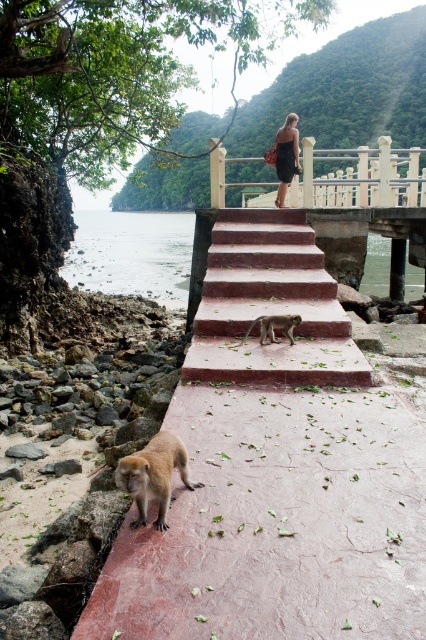
In the scene shown: Does smooth concrete stairs at center have a larger size compared to black dress at upper center?

Yes, smooth concrete stairs at center is bigger than black dress at upper center.

Does smooth concrete stairs at center come behind black dress at upper center?

No.

Identify the location of smooth concrete stairs at center. The image size is (426, 640). (270, 305).

Locate an element on the screen. The width and height of the screenshot is (426, 640). smooth concrete stairs at center is located at coordinates (270, 305).

Does smooth concrete stairs at center have a lesser width compared to brown furry monkey at center?

In fact, smooth concrete stairs at center might be wider than brown furry monkey at center.

Is smooth concrete stairs at center positioned before brown furry monkey at center?

No, smooth concrete stairs at center is behind brown furry monkey at center.

From the picture: Who is more forward, (293, 296) or (290, 317)?

Point (290, 317)

The height and width of the screenshot is (640, 426). Find the location of `smooth concrete stairs at center`. smooth concrete stairs at center is located at coordinates (270, 305).

Based on the photo, is golden fur monkey at lower left bigger than black dress at upper center?

No, golden fur monkey at lower left is not bigger than black dress at upper center.

Is point (161, 477) closer to camera compared to point (282, 150)?

Yes.

Identify the location of golden fur monkey at lower left. (154, 474).